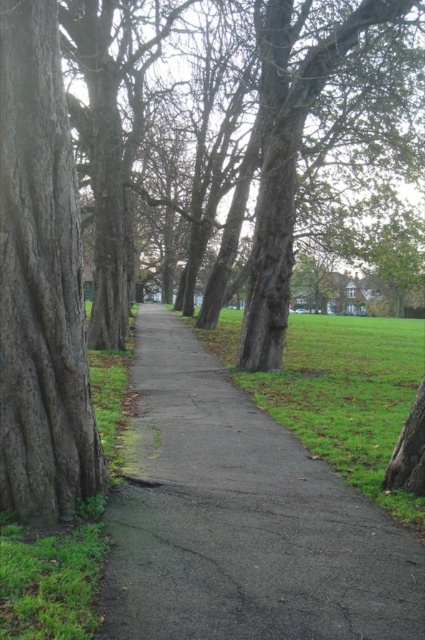
How far apart are gray asphalt path at center and dark brown textured bark at left?

gray asphalt path at center is 8.79 feet from dark brown textured bark at left.

Who is more distant from viewer, (206,378) or (68,260)?

Point (206,378)

This screenshot has height=640, width=425. Identify the location of gray asphalt path at center. (240, 518).

Looking at this image, does gray asphalt path at center appear over green grass at center?

Incorrect, gray asphalt path at center is not positioned above green grass at center.

Is gray asphalt path at center shorter than green grass at center?

Yes.

The width and height of the screenshot is (425, 640). What do you see at coordinates (240, 518) in the screenshot?
I see `gray asphalt path at center` at bounding box center [240, 518].

The height and width of the screenshot is (640, 425). Find the location of `gray asphalt path at center`. gray asphalt path at center is located at coordinates (240, 518).

Which is behind, point (96, 461) or point (354, 422)?

The point (354, 422) is behind.

You are a GUI agent. You are given a task and a screenshot of the screen. Output one action in this format:
    pyautogui.click(x=<x>, y=<y>)
    Task: Click on the dark brown textured bark at left
    
    Given the screenshot: What is the action you would take?
    pyautogui.click(x=40, y=282)

This screenshot has height=640, width=425. What are the coordinates of `dark brown textured bark at left` in the screenshot? It's located at (40, 282).